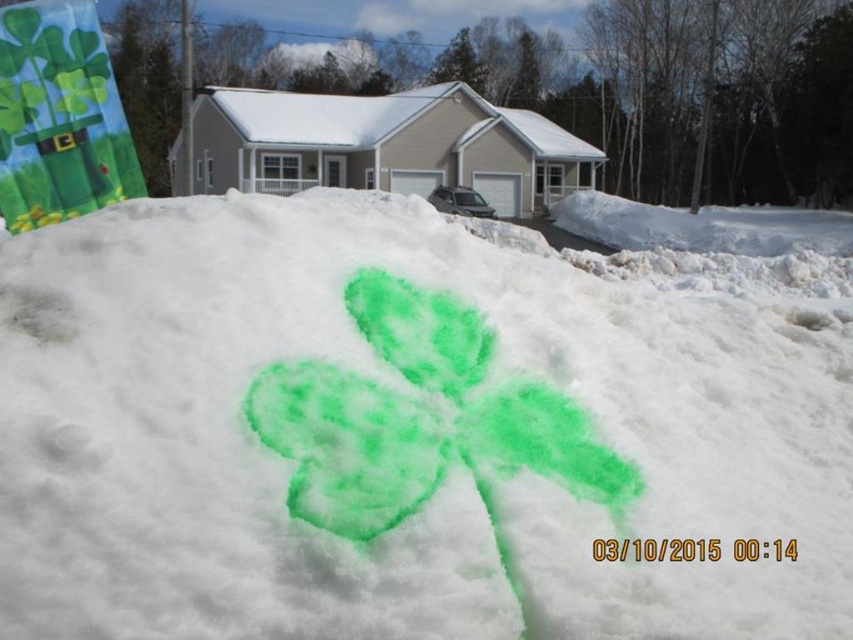
Question: Does green powder at center appear on the left side of green powder clover at center?

Choices:
 (A) no
 (B) yes

Answer: (A)

Question: Which point is closer to the camera?

Choices:
 (A) (445, 337)
 (B) (265, 330)

Answer: (B)

Question: Is green powder at center bigger than green powder clover at center?

Choices:
 (A) no
 (B) yes

Answer: (B)

Question: Does green powder at center appear under green powder clover at center?

Choices:
 (A) yes
 (B) no

Answer: (B)

Question: Which point is farther from the camera taking this photo?

Choices:
 (A) (402, 355)
 (B) (409, 451)

Answer: (A)

Question: Which point is closer to the camera?

Choices:
 (A) green powder clover at center
 (B) green powder at center

Answer: (B)